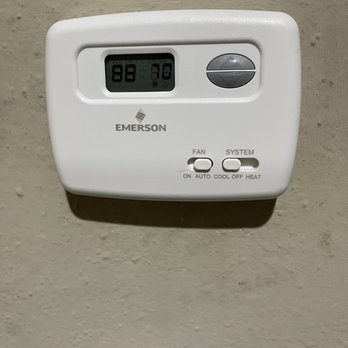
What are the coordinates of `off-white coloured painted wall` in the screenshot? It's located at 191,295.